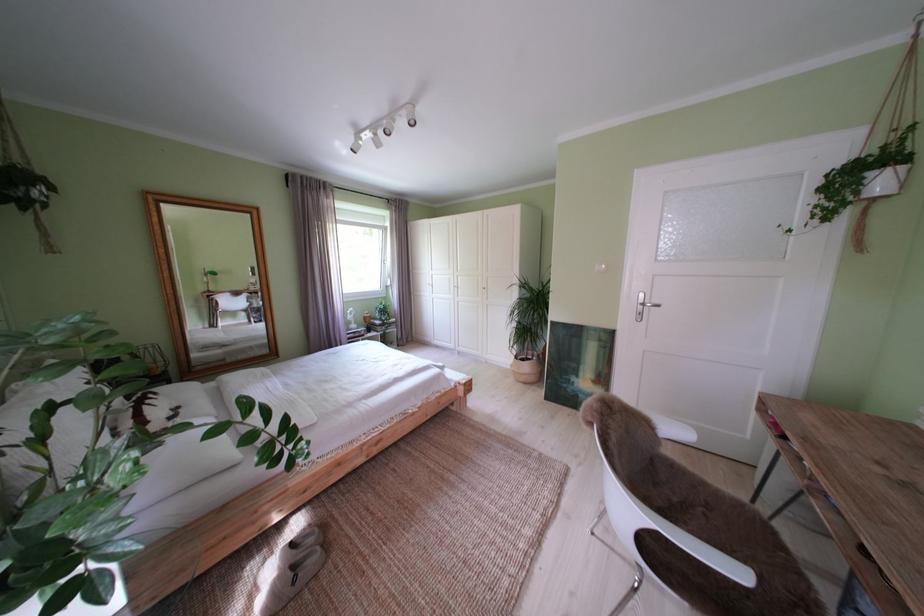
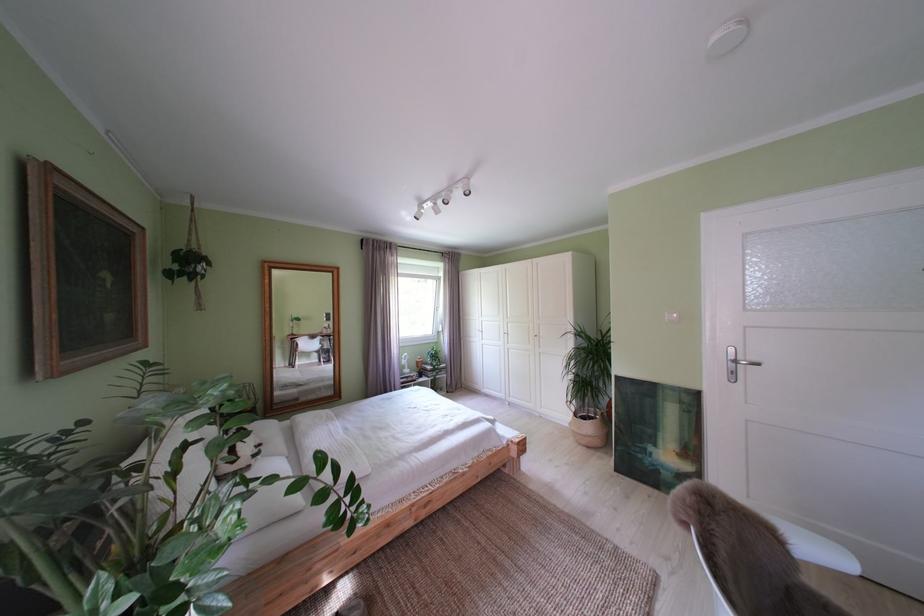
Where in the second image is the point corresponding to point (651, 306) from the first image?

(743, 363)